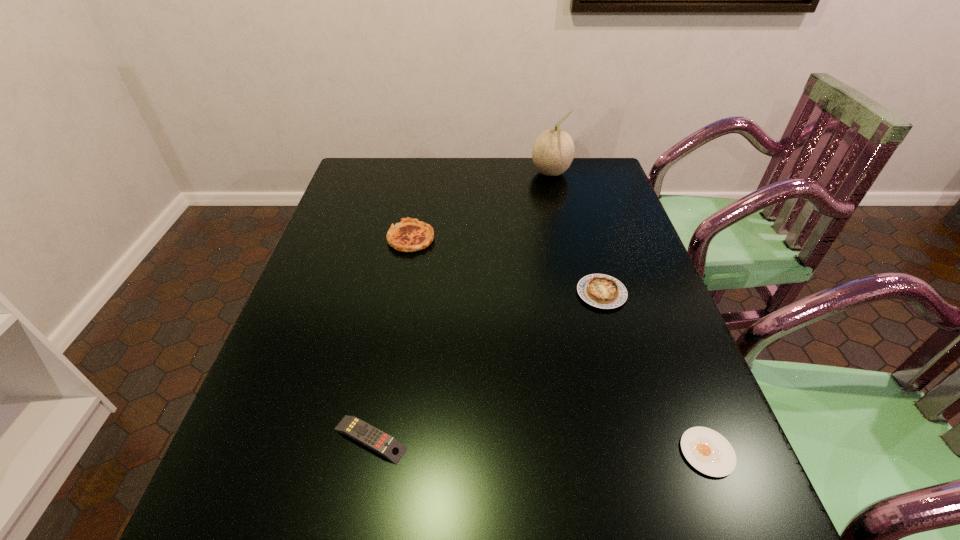
Where is `vacant space located 0.110m on the front of the farther quiche`? The width and height of the screenshot is (960, 540). vacant space located 0.110m on the front of the farther quiche is located at coordinates (403, 281).

Locate an element on the screen. Image resolution: width=960 pixels, height=540 pixels. free space located on the left of the shorter quiche is located at coordinates (427, 293).

Find the location of a particular element. vacant space located 0.060m on the front of the fourth tallest object is located at coordinates (358, 500).

Where is `vacant space located 0.400m on the left of the rightmost object`? The image size is (960, 540). vacant space located 0.400m on the left of the rightmost object is located at coordinates (465, 453).

This screenshot has width=960, height=540. I want to click on object that is positioned at the far edge, so click(x=553, y=151).

Image resolution: width=960 pixels, height=540 pixels. I want to click on cantaloup at the right edge, so click(553, 151).

The image size is (960, 540). Identify the location of quiche that is at the right edge. (602, 291).

Where is `egg yolk present at the right edge`? egg yolk present at the right edge is located at coordinates (709, 452).

At what (x,y) coordinates should I click in order to perform the action: click on object situated at the far right corner. Please return your answer as a coordinate pair (x, y). This screenshot has width=960, height=540. Looking at the image, I should click on point(553,151).

Find the location of a particular element. The width and height of the screenshot is (960, 540). vacant space at the far edge of the desktop is located at coordinates (516, 190).